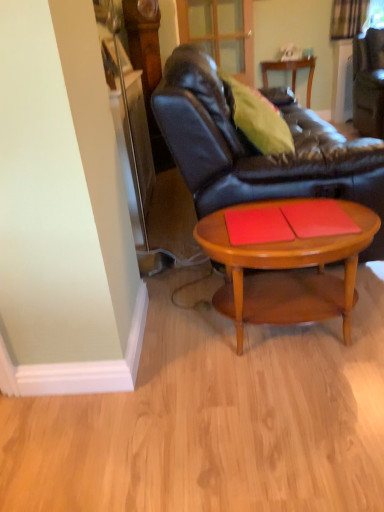
Where is `free space to the left of light brown wood coffee table at center`? Image resolution: width=384 pixels, height=512 pixels. free space to the left of light brown wood coffee table at center is located at coordinates (168, 350).